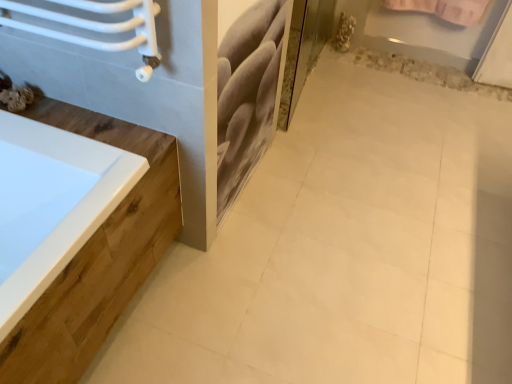
Question: Relative to white glossy ceramic tile at center, is clear glass screen door at upper center in front or behind?

Choices:
 (A) behind
 (B) front

Answer: (A)

Question: Considering the positions of clear glass screen door at upper center and white glossy ceramic tile at center in the image, is clear glass screen door at upper center bigger or smaller than white glossy ceramic tile at center?

Choices:
 (A) big
 (B) small

Answer: (B)

Question: In terms of width, does clear glass screen door at upper center look wider or thinner when compared to white glossy ceramic tile at center?

Choices:
 (A) wide
 (B) thin

Answer: (B)

Question: From a real-world perspective, is white glossy ceramic tile at center physically located above or below clear glass screen door at upper center?

Choices:
 (A) below
 (B) above

Answer: (A)

Question: Is white glossy ceramic tile at center wider or thinner than clear glass screen door at upper center?

Choices:
 (A) thin
 (B) wide

Answer: (B)

Question: In the image, is white glossy ceramic tile at center on the left side or the right side of clear glass screen door at upper center?

Choices:
 (A) left
 (B) right

Answer: (B)

Question: Would you say white glossy ceramic tile at center is inside or outside clear glass screen door at upper center?

Choices:
 (A) inside
 (B) outside

Answer: (B)